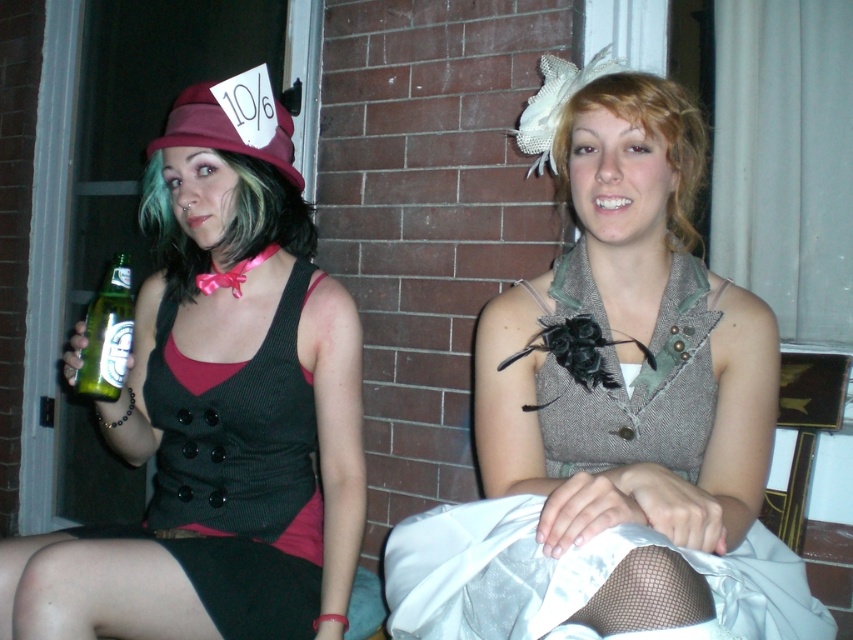
Consider the image. You are an artist trying to sketch the scene. You need to place the matte black vest at center in your drawing. What are the coordinates where you should position it?

The coordinates for the matte black vest at center are at point 0.644 on the x axis and 0.258 on the y axis.